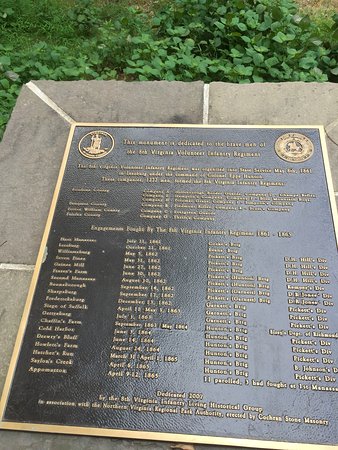
The width and height of the screenshot is (338, 450). Identify the location of plaque. (179, 249).